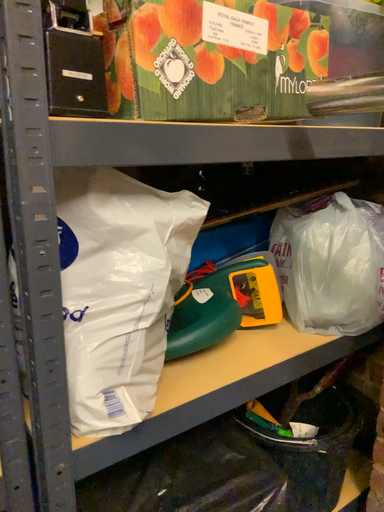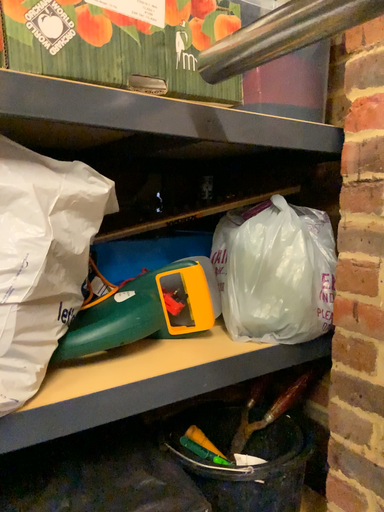
Question: Which way did the camera rotate in the video?

Choices:
 (A) rotated downward
 (B) rotated upward

Answer: (B)